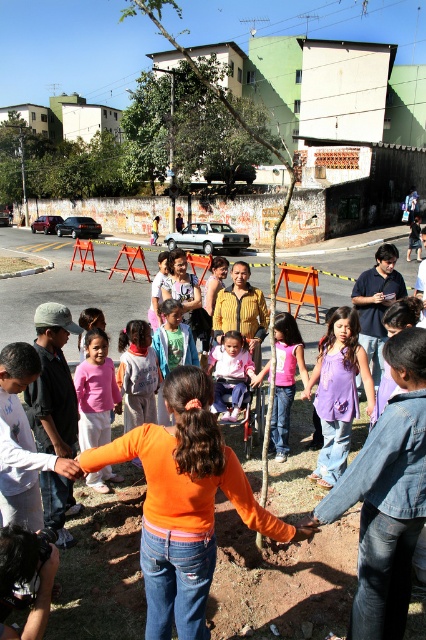
Can you confirm if orange denim jeans at center is positioned to the left of purple fabric dress at center?

Correct, you'll find orange denim jeans at center to the left of purple fabric dress at center.

Is point (207, 512) less distant than point (353, 356)?

Yes.

Which is in front, point (161, 468) or point (339, 381)?

Point (161, 468) is more forward.

What are the coordinates of `orange denim jeans at center` in the screenshot? It's located at (184, 502).

Can you confirm if purple fabric dress at center is thinner than pink fabric shirt at center?

No, purple fabric dress at center is not thinner than pink fabric shirt at center.

Which of these two, purple fabric dress at center or pink fabric shirt at center, stands taller?

purple fabric dress at center is taller.

Consider the image. Measure the distance between point (x=322, y=388) and camera.

4.87 meters

Find the location of a particular element. The height and width of the screenshot is (640, 426). purple fabric dress at center is located at coordinates (337, 392).

Is point (221, 157) positioned in front of point (124, 12)?

Yes, point (221, 157) is closer to viewer.

Where is `green leafy tree at upper center`? green leafy tree at upper center is located at coordinates (210, 136).